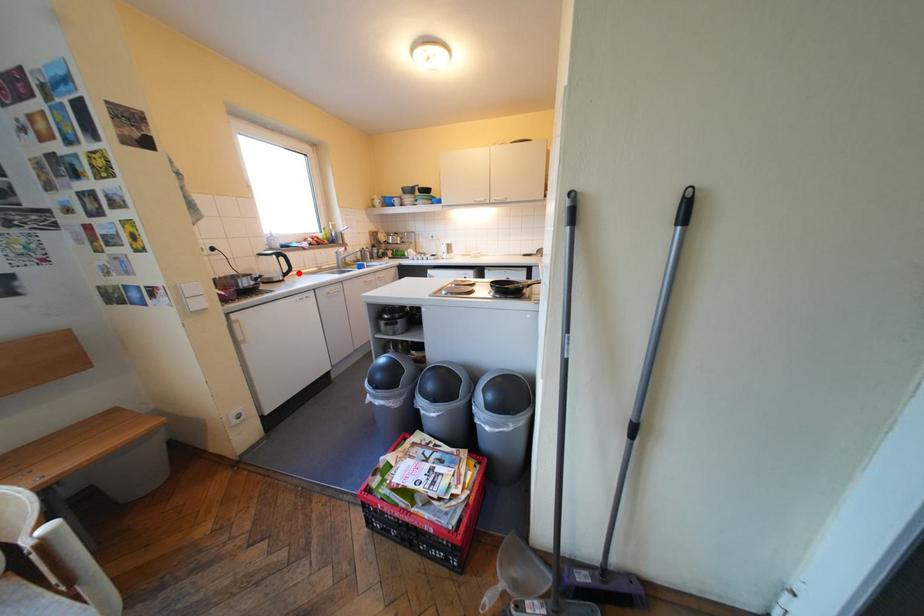
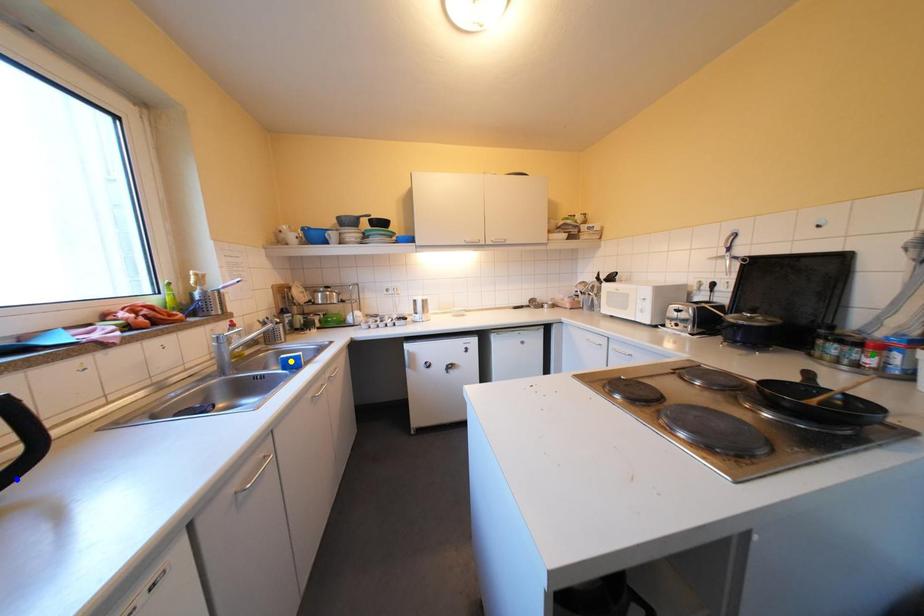
Question: I am providing you with two images of the same scene from different viewpoints. A red point is marked on the first image. You are given multiple points on the second image. Which mark in image 2 goes with the point in image 1?

Choices:
 (A) blue point
 (B) green point
 (C) yellow point

Answer: (A)